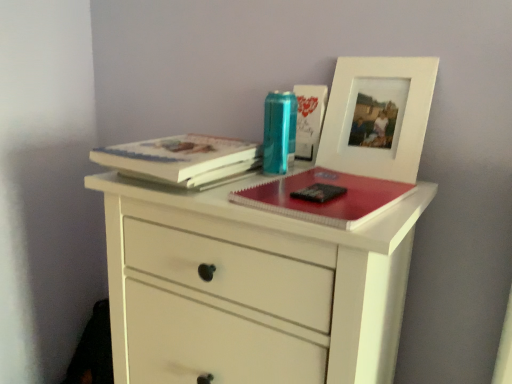
This screenshot has width=512, height=384. What do you see at coordinates (181, 159) in the screenshot?
I see `hardcover book at upper left, which is the 1th paperback book from left to right` at bounding box center [181, 159].

The width and height of the screenshot is (512, 384). What do you see at coordinates (380, 101) in the screenshot?
I see `white matte picture frame at upper right` at bounding box center [380, 101].

Measure the distance between point [277,137] and camera.

The distance of point [277,137] from camera is 82.60 centimeters.

Identify the location of hardcover book at upper left, marked as the 2th paperback book in a right-to-left arrangement. (181, 159).

Which is farther, (326,98) or (196,151)?

The point (326,98) is farther.

Does hardcover book at upper right, the first paperback book viewed from the right, touch hardcover book at upper left, which is the 1th paperback book from left to right?

No, hardcover book at upper right, the first paperback book viewed from the right, is not in contact with hardcover book at upper left, which is the 1th paperback book from left to right.

Does hardcover book at upper right, positioned as the second paperback book in left-to-right order, appear on the right side of hardcover book at upper left, marked as the 2th paperback book in a right-to-left arrangement?

Yes, hardcover book at upper right, positioned as the second paperback book in left-to-right order, is to the right of hardcover book at upper left, marked as the 2th paperback book in a right-to-left arrangement.

Which of these two, hardcover book at upper right, the first paperback book viewed from the right, or hardcover book at upper left, marked as the 2th paperback book in a right-to-left arrangement, is bigger?

hardcover book at upper left, marked as the 2th paperback book in a right-to-left arrangement, is bigger.

Does point (278, 153) come farther from viewer compared to point (342, 250)?

Yes, point (278, 153) is behind point (342, 250).

Where is `turquoise lying above the white matte chest of drawers at center (from the image's perspective)`? turquoise lying above the white matte chest of drawers at center (from the image's perspective) is located at coordinates (279, 132).

From a real-world perspective, is translucent plastic can at center physically below white matte chest of drawers at center?

Incorrect, from a real-world perspective, translucent plastic can at center is higher than white matte chest of drawers at center.

Between white matte picture frame at upper right and white matte chest of drawers at center, which one is positioned in front?

white matte chest of drawers at center is closer to the camera.

Where is `the chest of drawers that appears below the white matte picture frame at upper right (from the image's perspective)`? The image size is (512, 384). the chest of drawers that appears below the white matte picture frame at upper right (from the image's perspective) is located at coordinates (252, 287).

Which point is more forward, (329, 98) or (269, 361)?

The point (269, 361) is closer.

Where is `picture frame above the hardcover book at upper right, positioned as the second paperback book in left-to-right order (from a real-world perspective)`? picture frame above the hardcover book at upper right, positioned as the second paperback book in left-to-right order (from a real-world perspective) is located at coordinates (380, 101).

From the image's perspective, relative to white matte picture frame at upper right, is hardcover book at upper right, the first paperback book viewed from the right, above or below?

Clearly, from the image's perspective, hardcover book at upper right, the first paperback book viewed from the right, is above white matte picture frame at upper right.

Is hardcover book at upper right, the first paperback book viewed from the right, positioned with its back to white matte picture frame at upper right?

That's not correct — hardcover book at upper right, the first paperback book viewed from the right, is not looking away from white matte picture frame at upper right.

From a real-world perspective, is hardcover book at upper right, the first paperback book viewed from the right, above or below translucent plastic can at center?

hardcover book at upper right, the first paperback book viewed from the right, is situated higher than translucent plastic can at center in the real world.

The image size is (512, 384). Identify the location of turquoise below the hardcover book at upper right, the first paperback book viewed from the right (from the image's perspective). (279, 132).

Is hardcover book at upper right, the first paperback book viewed from the right, further to camera compared to translucent plastic can at center?

Yes, hardcover book at upper right, the first paperback book viewed from the right, is further from the viewer.

In terms of size, does white matte picture frame at upper right appear bigger or smaller than hardcover book at upper left, marked as the 2th paperback book in a right-to-left arrangement?

Clearly, white matte picture frame at upper right is smaller in size than hardcover book at upper left, marked as the 2th paperback book in a right-to-left arrangement.

From a real-world perspective, which is physically above, white matte picture frame at upper right or hardcover book at upper left, marked as the 2th paperback book in a right-to-left arrangement?

white matte picture frame at upper right is physically above.

Identify the location of picture frame above the hardcover book at upper left, marked as the 2th paperback book in a right-to-left arrangement (from the image's perspective). This screenshot has width=512, height=384. (380, 101).

Is white matte picture frame at upper right outside of hardcover book at upper left, marked as the 2th paperback book in a right-to-left arrangement?

Indeed, white matte picture frame at upper right is completely outside hardcover book at upper left, marked as the 2th paperback book in a right-to-left arrangement.

Would you say hardcover book at upper right, positioned as the second paperback book in left-to-right order, contains matte red notebook at center?

No, matte red notebook at center is located outside of hardcover book at upper right, positioned as the second paperback book in left-to-right order.

Is hardcover book at upper right, the first paperback book viewed from the right, positioned behind matte red notebook at center?

Yes, the depth of hardcover book at upper right, the first paperback book viewed from the right, is greater than that of matte red notebook at center.

Is point (323, 116) positioned before point (295, 189)?

No, it is behind (295, 189).

This screenshot has width=512, height=384. I want to click on the 1st paperback book to the left when counting from the matte red notebook at center, so click(x=309, y=119).

What are the coordinates of `paperback book that is on the right side of hardcover book at upper left, marked as the 2th paperback book in a right-to-left arrangement` in the screenshot? It's located at (309, 119).

Image resolution: width=512 pixels, height=384 pixels. In order to click on the chest of drawers beneath the translucent plastic can at center (from a real-world perspective) in this screenshot , I will do `click(252, 287)`.

Based on their spatial positions, is hardcover book at upper right, the first paperback book viewed from the right, or matte red notebook at center closer to white matte chest of drawers at center?

matte red notebook at center.

From the image, which object appears to be farther from hardcover book at upper left, marked as the 2th paperback book in a right-to-left arrangement, white matte picture frame at upper right or translucent plastic can at center?

white matte picture frame at upper right lies further to hardcover book at upper left, marked as the 2th paperback book in a right-to-left arrangement, than the other object.

Looking at the image, which one is located further to hardcover book at upper right, the first paperback book viewed from the right, hardcover book at upper left, marked as the 2th paperback book in a right-to-left arrangement, or white matte chest of drawers at center?

white matte chest of drawers at center is further to hardcover book at upper right, the first paperback book viewed from the right.

Estimate the real-world distances between objects in this image. Which object is closer to hardcover book at upper right, positioned as the second paperback book in left-to-right order, white matte picture frame at upper right or translucent plastic can at center?

Based on the image, translucent plastic can at center appears to be nearer to hardcover book at upper right, positioned as the second paperback book in left-to-right order.

Looking at the image, which one is located further to white matte picture frame at upper right, matte red notebook at center or hardcover book at upper left, marked as the 2th paperback book in a right-to-left arrangement?

The object further to white matte picture frame at upper right is hardcover book at upper left, marked as the 2th paperback book in a right-to-left arrangement.

Estimate the real-world distances between objects in this image. Which object is further from white matte picture frame at upper right, hardcover book at upper right, positioned as the second paperback book in left-to-right order, or hardcover book at upper left, which is the 1th paperback book from left to right?

hardcover book at upper left, which is the 1th paperback book from left to right, lies further to white matte picture frame at upper right than the other object.

Looking at the image, which one is located further to white matte chest of drawers at center, matte red notebook at center or white matte picture frame at upper right?

white matte picture frame at upper right.

Looking at the image, which one is located closer to hardcover book at upper left, which is the 1th paperback book from left to right, hardcover book at upper right, the first paperback book viewed from the right, or translucent plastic can at center?

The object closer to hardcover book at upper left, which is the 1th paperback book from left to right, is translucent plastic can at center.

The image size is (512, 384). Identify the location of picture frame located between matte red notebook at center and translucent plastic can at center in the depth direction. (380, 101).

Find the location of a particular element. This screenshot has width=512, height=384. turquoise between hardcover book at upper left, which is the 1th paperback book from left to right, and hardcover book at upper right, positioned as the second paperback book in left-to-right order, from left to right is located at coordinates (279, 132).

Identify the location of magazine between hardcover book at upper left, marked as the 2th paperback book in a right-to-left arrangement, and white matte picture frame at upper right, in the horizontal direction. The image size is (512, 384). (324, 197).

Where is `magazine between white matte picture frame at upper right and white matte chest of drawers at center in the vertical direction`? The height and width of the screenshot is (384, 512). magazine between white matte picture frame at upper right and white matte chest of drawers at center in the vertical direction is located at coordinates (324, 197).